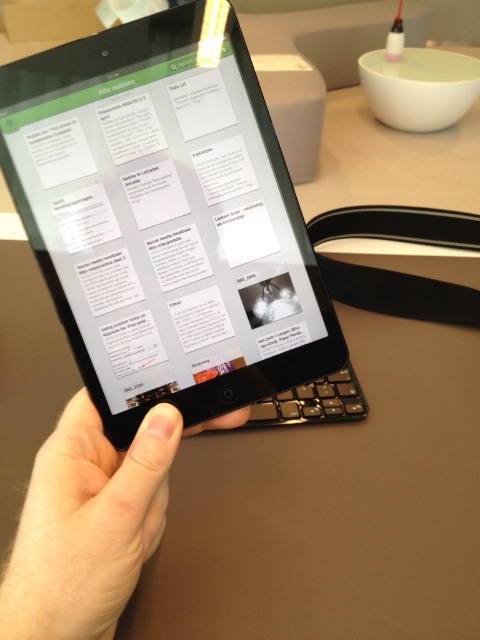
You are trying to use your tablet but notice your finger is blocking part of the screen. Based on the scene, can you tell if the black matte tablet at center is positioned above your skinny white finger at center?

Yes, the black matte tablet at center is above the skinny white finger at center, so the finger is below the tablet and might be blocking the lower part of the screen.

You are trying to determine if the black matte tablet at center can fit into a drawer that is 10 cm tall. Given that the tablet is much taller than the skinny white finger at center, and the finger is 5 cm long, can the tablet fit into the drawer?

The black matte tablet at center is much taller than the skinny white finger at center, which is 5 cm long. Since the tablet is taller than 5 cm, it cannot fit into the 10 cm tall drawer.

You are holding a black matte tablet at center in your hand and there is a skinny white finger at center pointing at it. You want to touch the screen of the tablet. Can you reach the screen without moving your finger?

The black matte tablet at center is 4.15 inches away from the skinny white finger at center. Since the finger is pointing at the tablet but not touching it, you need to move your finger closer to reach the screen.